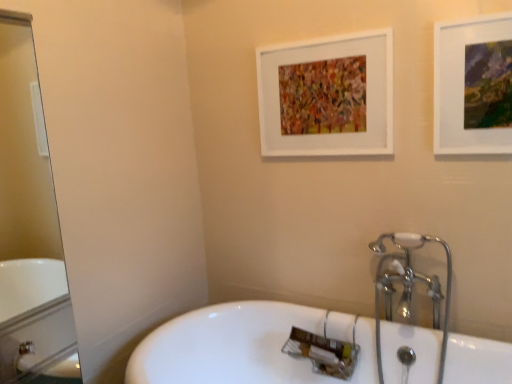
Question: Can you confirm if matte white picture frame at upper right, which appears as the second picture frame when viewed from the back, is thinner than clear glass mirror at left?

Choices:
 (A) yes
 (B) no

Answer: (A)

Question: From the image's perspective, is matte white picture frame at upper right, the 1th picture frame from the right, on top of clear glass mirror at left?

Choices:
 (A) no
 (B) yes

Answer: (B)

Question: Can you confirm if matte white picture frame at upper right, arranged as the 1th picture frame when viewed from the front, is smaller than clear glass mirror at left?

Choices:
 (A) yes
 (B) no

Answer: (A)

Question: Can you confirm if matte white picture frame at upper right, marked as the 2th picture frame in a left-to-right arrangement, is bigger than clear glass mirror at left?

Choices:
 (A) yes
 (B) no

Answer: (B)

Question: Is matte white picture frame at upper right, the 1th picture frame from the right, aimed at clear glass mirror at left?

Choices:
 (A) no
 (B) yes

Answer: (A)

Question: Is matte white picture frame at upper right, which appears as the second picture frame when viewed from the back, at the left side of clear glass mirror at left?

Choices:
 (A) yes
 (B) no

Answer: (B)

Question: Is white matte picture frame at upper center, marked as the 1th picture frame in a back-to-front arrangement, completely or partially outside of white glossy bathtub at center?

Choices:
 (A) yes
 (B) no

Answer: (A)

Question: From the image's perspective, is white matte picture frame at upper center, placed as the 1th picture frame when sorted from left to right, over white glossy bathtub at center?

Choices:
 (A) yes
 (B) no

Answer: (A)

Question: Is white matte picture frame at upper center, which is the 2th picture frame from front to back, behind white glossy bathtub at center?

Choices:
 (A) yes
 (B) no

Answer: (A)

Question: Is white matte picture frame at upper center, the second picture frame in the right-to-left sequence, smaller than white glossy bathtub at center?

Choices:
 (A) yes
 (B) no

Answer: (A)

Question: Considering the relative sizes of white matte picture frame at upper center, marked as the 1th picture frame in a back-to-front arrangement, and white glossy bathtub at center in the image provided, is white matte picture frame at upper center, marked as the 1th picture frame in a back-to-front arrangement, wider than white glossy bathtub at center?

Choices:
 (A) no
 (B) yes

Answer: (A)

Question: Is white matte picture frame at upper center, the second picture frame in the right-to-left sequence, in front of white glossy bathtub at center?

Choices:
 (A) no
 (B) yes

Answer: (A)

Question: Is white glossy bathtub at center turned away from clear glass mirror at left?

Choices:
 (A) no
 (B) yes

Answer: (A)